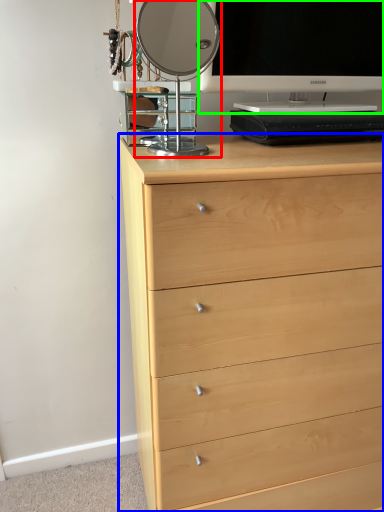
Question: Which object is positioned closest to table lamp (highlighted by a red box)? Select from chest of drawers (highlighted by a blue box) and television (highlighted by a green box).

Choices:
 (A) chest of drawers
 (B) television

Answer: (B)